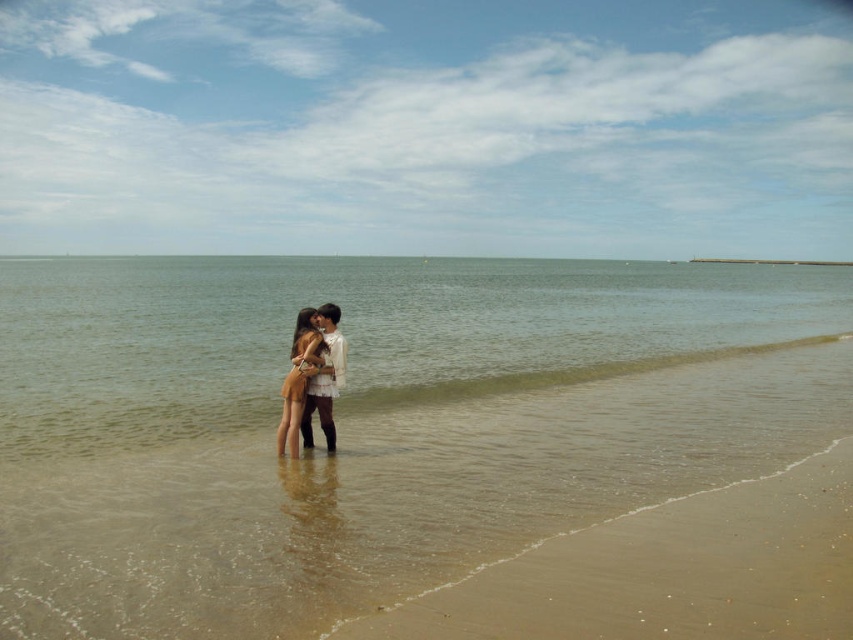
Which is behind, point (628, 433) or point (93, 397)?

Positioned behind is point (93, 397).

Does smooth sand beach at center have a greater height compared to clear water at center?

No.

What do you see at coordinates (389, 499) in the screenshot? I see `smooth sand beach at center` at bounding box center [389, 499].

At what (x,y) coordinates should I click in order to perform the action: click on smooth sand beach at center. Please return your answer as a coordinate pair (x, y). Looking at the image, I should click on (389, 499).

Who is positioned more to the left, smooth sand beach at center or matte beige dress at center?

Result: matte beige dress at center

Can you confirm if smooth sand beach at center is taller than matte beige dress at center?

In fact, smooth sand beach at center may be shorter than matte beige dress at center.

Measure the distance between smooth sand beach at center and camera.

A distance of 5.12 meters exists between smooth sand beach at center and camera.

At what (x,y) coordinates should I click in order to perform the action: click on smooth sand beach at center. Please return your answer as a coordinate pair (x, y). The image size is (853, 640). Looking at the image, I should click on (x=389, y=499).

In the scene shown: Can you confirm if clear water at center is thinner than matte beige dress at center?

Incorrect, clear water at center's width is not less than matte beige dress at center's.

Who is positioned more to the left, clear water at center or matte beige dress at center?

Positioned to the left is clear water at center.

Is point (473, 278) positioned in front of point (281, 388)?

No, it is behind (281, 388).

The width and height of the screenshot is (853, 640). I want to click on clear water at center, so click(x=357, y=333).